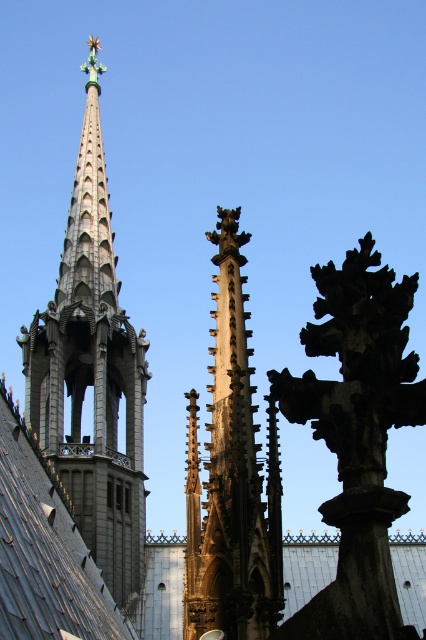
Between brown stone spire at center and gray slate roof at center, which one appears on the left side from the viewer's perspective?

gray slate roof at center

Which is behind, point (264, 509) or point (26, 593)?

Point (264, 509)

Locate an element on the screen. brown stone spire at center is located at coordinates (232, 477).

Who is higher up, gray stone spire at upper left or gray slate roof at center?

gray stone spire at upper left is higher up.

From the picture: Is gray stone spire at upper left shorter than gray slate roof at center?

No.

Who is more forward, (88, 305) or (32, 440)?

Positioned in front is point (32, 440).

This screenshot has width=426, height=640. What are the coordinates of `gray stone spire at upper left` in the screenshot? It's located at (92, 372).

Who is higher up, gray stone spire at upper left or brown stone spire at center?

Positioned higher is gray stone spire at upper left.

Locate an element on the screen. Image resolution: width=426 pixels, height=640 pixels. gray stone spire at upper left is located at coordinates (92, 372).